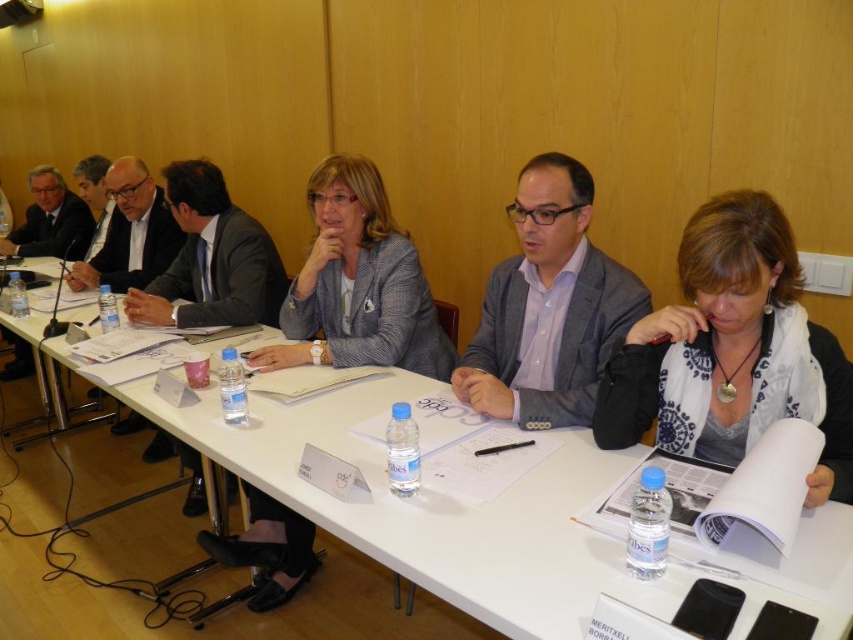
Is matte gray blazer at center above gray textured blazer at center?

Yes, matte gray blazer at center is above gray textured blazer at center.

Does matte gray blazer at center have a lesser width compared to gray textured blazer at center?

No, matte gray blazer at center is not thinner than gray textured blazer at center.

Who is more distant from viewer, (260, 522) or (526, 280)?

Point (260, 522)

Locate an element on the screen. matte gray blazer at center is located at coordinates (357, 284).

Does white paper at center appear over white printed scarf at center?

Incorrect, white paper at center is not positioned above white printed scarf at center.

Does point (56, 340) come behind point (698, 292)?

Yes, point (56, 340) is behind point (698, 292).

Locate an element on the screen. This screenshot has height=640, width=853. white paper at center is located at coordinates (437, 508).

Can you confirm if white printed scarf at center is bigger than gray textured blazer at center?

Actually, white printed scarf at center might be smaller than gray textured blazer at center.

What do you see at coordinates (732, 352) in the screenshot? The height and width of the screenshot is (640, 853). I see `white printed scarf at center` at bounding box center [732, 352].

The width and height of the screenshot is (853, 640). What are the coordinates of `white printed scarf at center` in the screenshot? It's located at (732, 352).